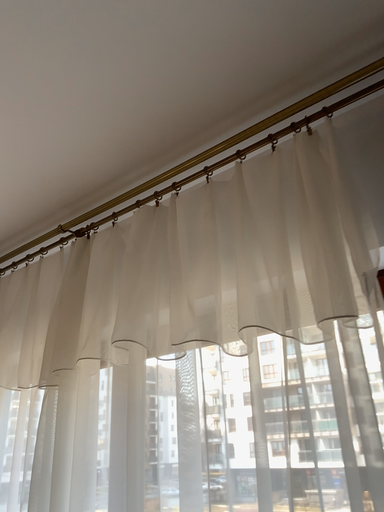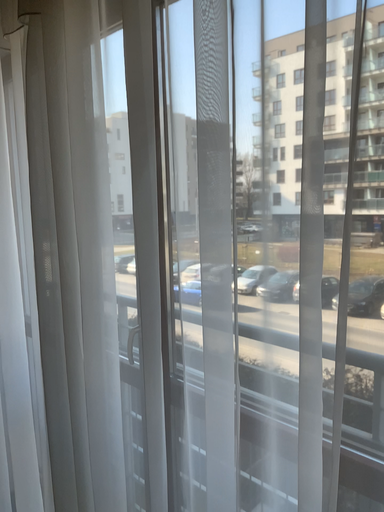
Question: Which way did the camera rotate in the video?

Choices:
 (A) rotated downward
 (B) rotated upward

Answer: (A)